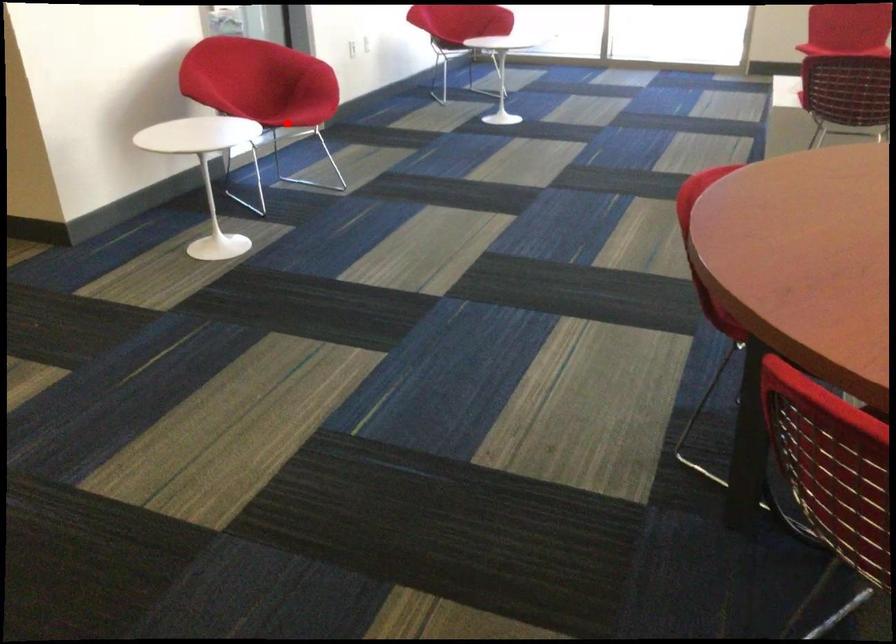
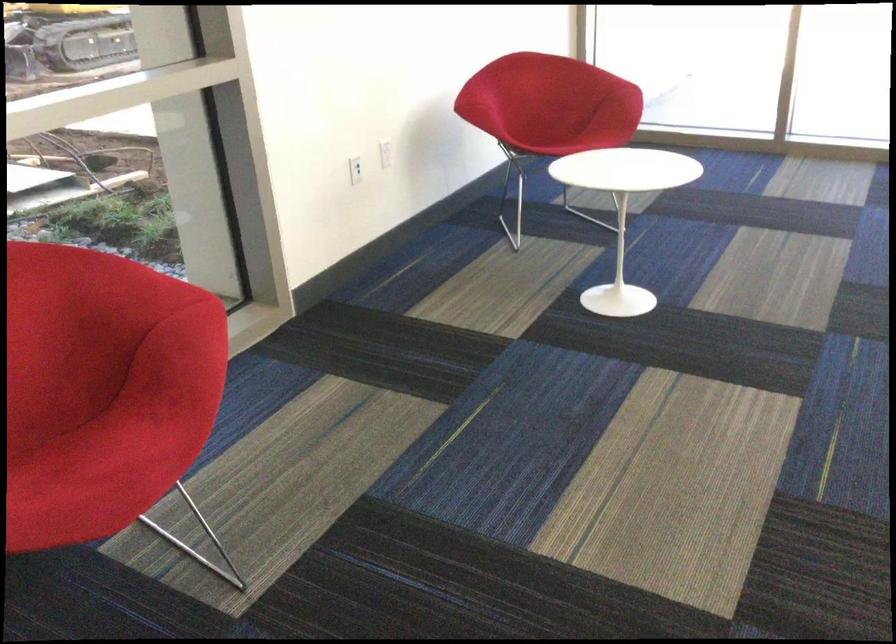
Question: A red point is marked in image1. In image2, is the corresponding 3D point closer to the camera or farther? Reply with the corresponding letter.

Choices:
 (A) The corresponding 3D point is closer.
 (B) The corresponding 3D point is farther.

Answer: (A)